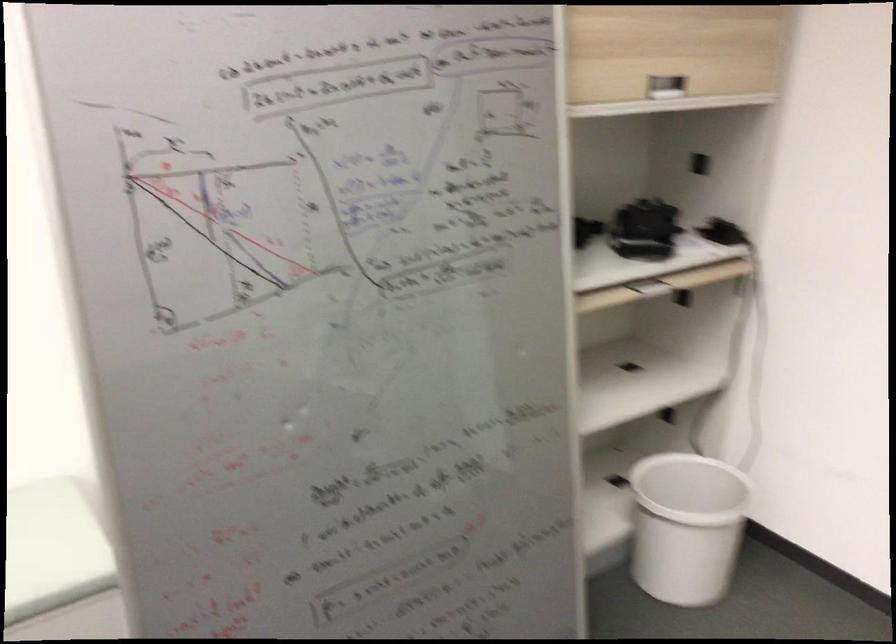
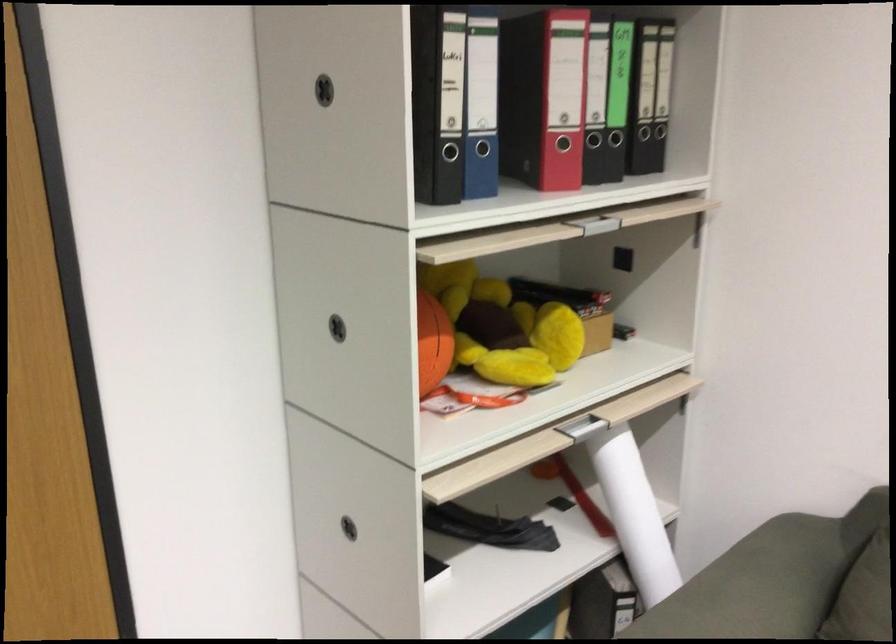
The first image is from the beginning of the video and the second image is from the end. How did the camera likely rotate when shooting the video?

The camera's rotation is toward right-down.